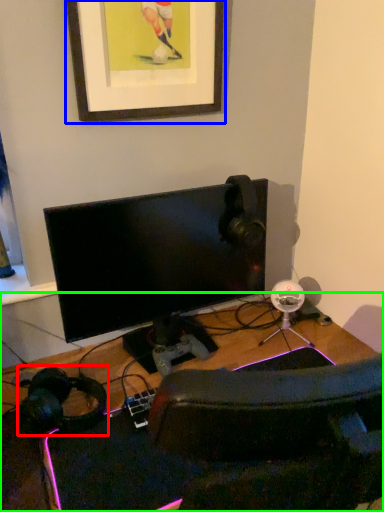
Question: Considering the real-world distances, which object is closest to headphones (highlighted by a red box)? picture frame (highlighted by a blue box) or desk (highlighted by a green box).

Choices:
 (A) picture frame
 (B) desk

Answer: (B)